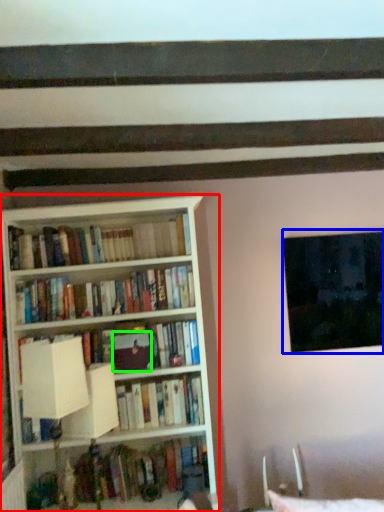
Question: Which object is positioned closest to bookcase (highlighted by a red box)? Select from window (highlighted by a blue box) and paperback book (highlighted by a green box).

Choices:
 (A) window
 (B) paperback book

Answer: (B)